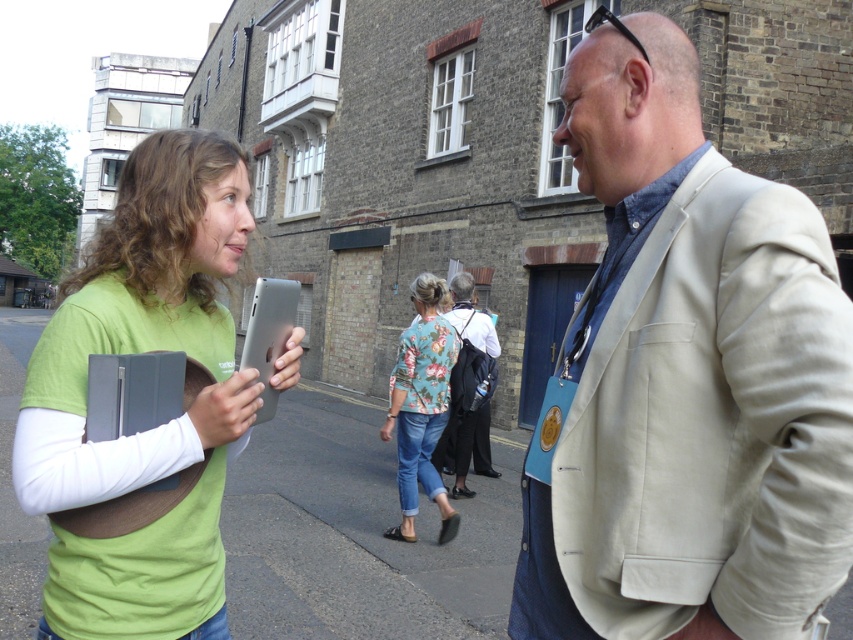
Is green matte shirt at left in front of gray asphalt at center?

Yes, green matte shirt at left is in front of gray asphalt at center.

Which is more to the right, green matte shirt at left or gray asphalt at center?

green matte shirt at left

Does point (80, 605) come closer to viewer compared to point (318, 618)?

Yes, it is in front of point (318, 618).

I want to click on green matte shirt at left, so click(154, 428).

Is beige fabric jacket at center positioned at the back of green matte shirt at left?

That is False.

Which of these two, beige fabric jacket at center or green matte shirt at left, stands taller?

beige fabric jacket at center

Who is more distant from viewer, [730,310] or [126,592]?

The point [126,592] is behind.

The image size is (853, 640). What are the coordinates of `beige fabric jacket at center` in the screenshot? It's located at (688, 380).

Does beige fabric jacket at center lie in front of floral fabric blouse at center?

Yes, beige fabric jacket at center is closer to the viewer.

Does beige fabric jacket at center have a smaller size compared to floral fabric blouse at center?

Yes.

Describe the element at coordinates (688, 380) in the screenshot. I see `beige fabric jacket at center` at that location.

Locate an element on the screen. beige fabric jacket at center is located at coordinates (688, 380).